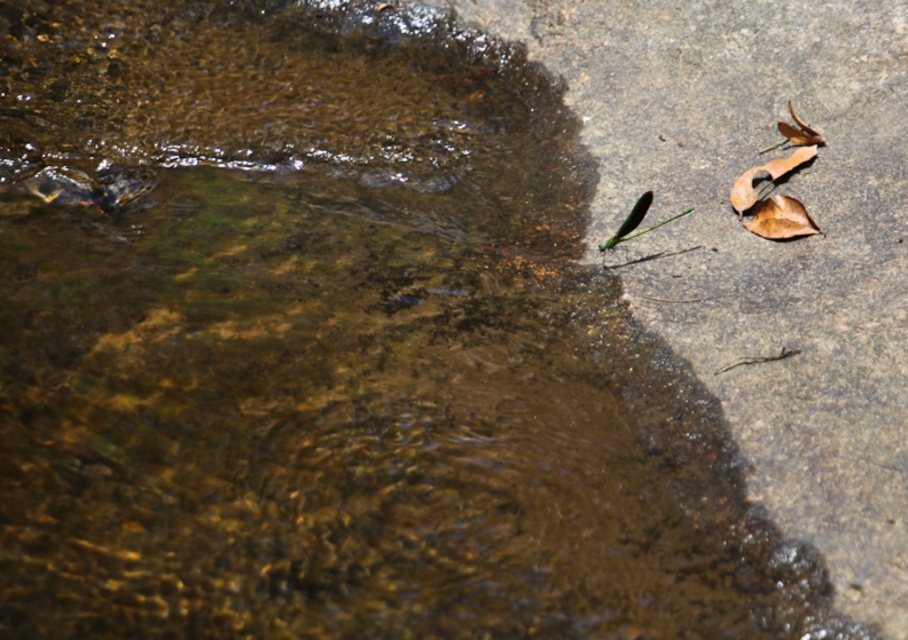
Question: Among these points, which one is nearest to the camera?

Choices:
 (A) pos(775,173)
 (B) pos(760,204)

Answer: (B)

Question: Does brown/dry leaf at right have a smaller size compared to brown matte leaf at right?

Choices:
 (A) no
 (B) yes

Answer: (B)

Question: Is brown/dry leaf at right to the left of brown matte leaf at right from the viewer's perspective?

Choices:
 (A) no
 (B) yes

Answer: (B)

Question: Can you confirm if brown/dry leaf at right is thinner than brown matte leaf at right?

Choices:
 (A) no
 (B) yes

Answer: (B)